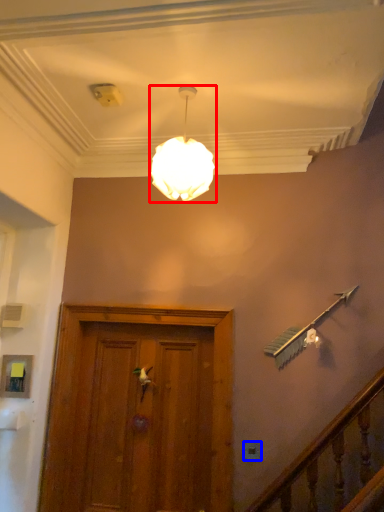
Question: Among these objects, which one is nearest to the camera, lamp (highlighted by a red box) or electric outlet (highlighted by a blue box)?

Choices:
 (A) lamp
 (B) electric outlet

Answer: (A)